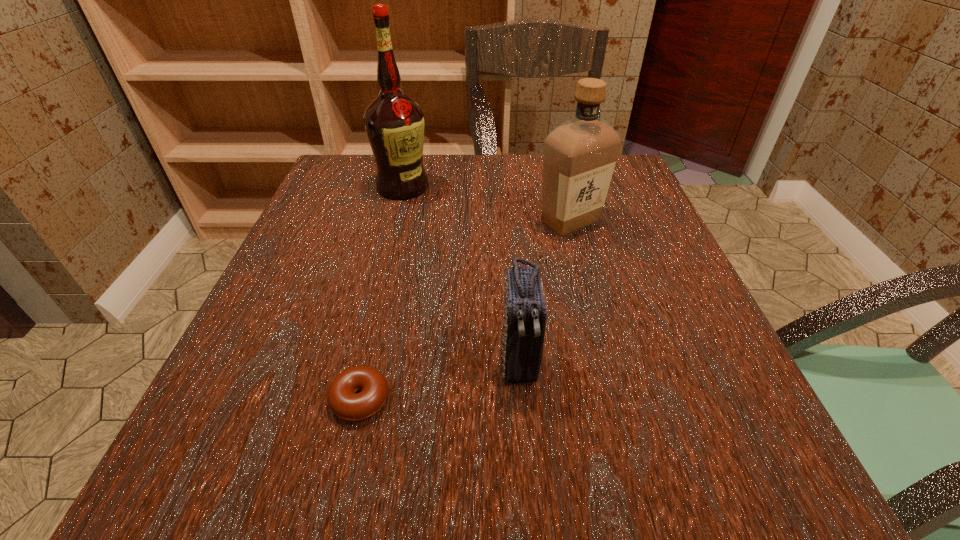
Locate an element on the screen. The height and width of the screenshot is (540, 960). free space at the right edge is located at coordinates (645, 272).

This screenshot has height=540, width=960. Identify the location of vacant space at the far right corner. (622, 166).

You are a GUI agent. You are given a task and a screenshot of the screen. Output one action in this format:
    pyautogui.click(x=<x>, y=<y>)
    Task: Click on the vacant space at the near right corner
    This screenshot has height=540, width=960.
    Given the screenshot: What is the action you would take?
    pyautogui.click(x=795, y=488)

The width and height of the screenshot is (960, 540). Identify the location of blank region between the second tallest object and the doughnut. (466, 310).

Identify the location of free spot between the clutch bag and the liquor. (544, 292).

This screenshot has height=540, width=960. In order to click on vacant area between the alcohol and the third tallest object in this screenshot , I will do `click(461, 275)`.

This screenshot has width=960, height=540. I want to click on vacant space that is in between the alcohol and the second shortest object, so click(461, 275).

Locate an element on the screen. This screenshot has height=540, width=960. vacant area between the liquor and the shortest object is located at coordinates (466, 310).

Where is `blank region between the tallest object and the second shortest object`? Image resolution: width=960 pixels, height=540 pixels. blank region between the tallest object and the second shortest object is located at coordinates (461, 275).

Locate an element on the screen. The height and width of the screenshot is (540, 960). vacant space that's between the third object from left to right and the doughnut is located at coordinates (440, 381).